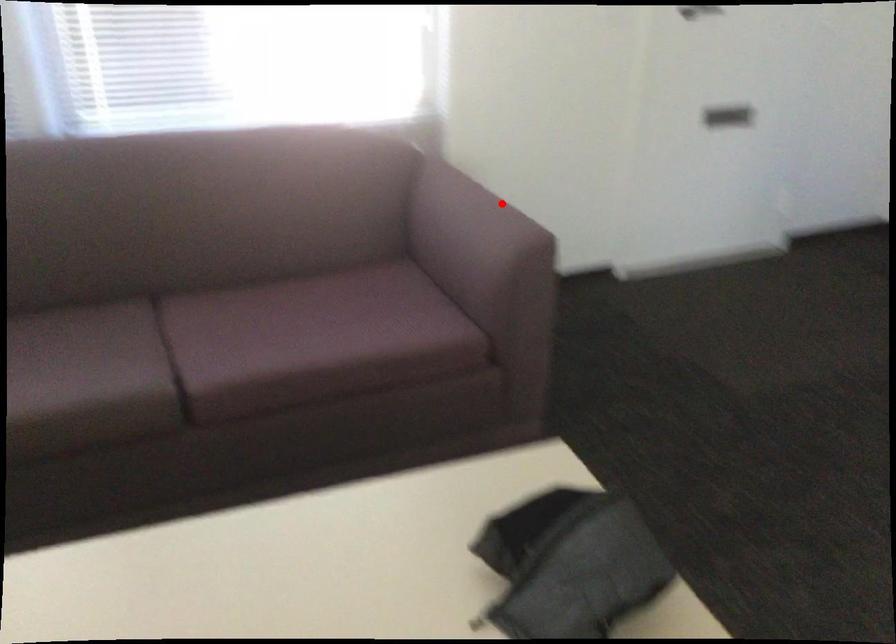
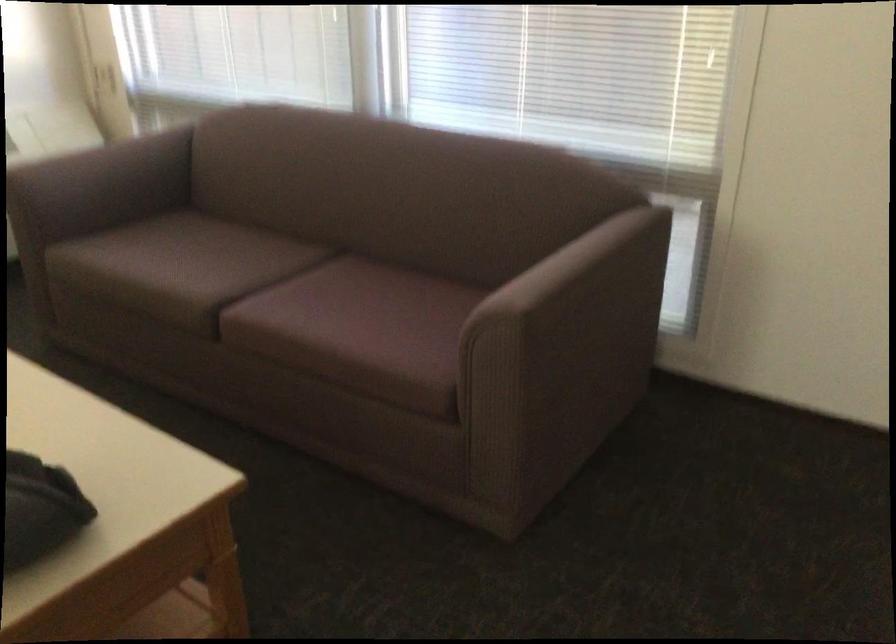
Question: A red point is marked in image1. In image2, is the corresponding 3D point closer to the camera or farther? Reply with the corresponding letter.

Choices:
 (A) The corresponding 3D point is closer.
 (B) The corresponding 3D point is farther.

Answer: (A)